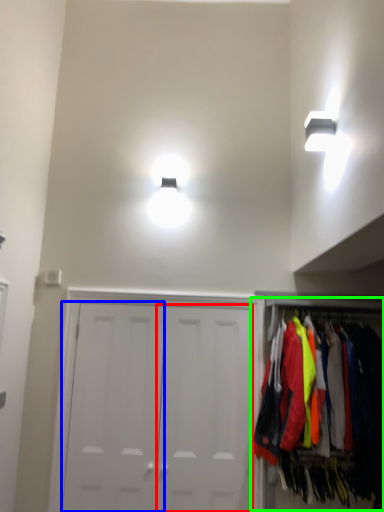
Question: Which object is the closest to the door (highlighted by a red box)? Choose among these: door (highlighted by a blue box) or closet (highlighted by a green box).

Choices:
 (A) door
 (B) closet

Answer: (A)